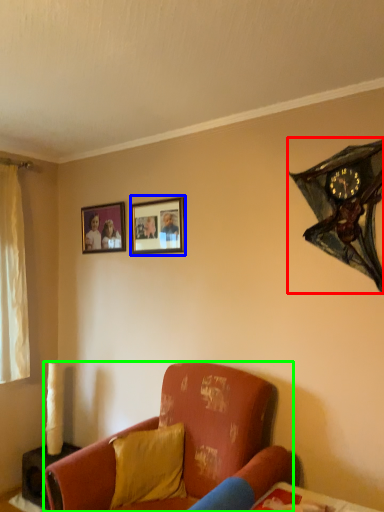
Question: Estimate the real-world distances between objects in this image. Which object is farther from clock (highlighted by a red box), picture frame (highlighted by a blue box) or studio couch (highlighted by a green box)?

Choices:
 (A) picture frame
 (B) studio couch

Answer: (B)